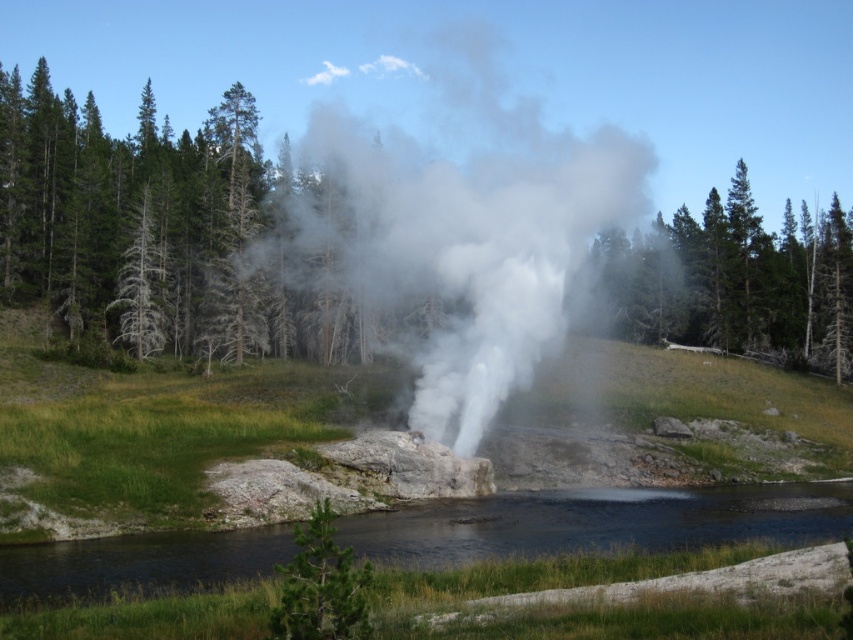
Is point (746, 196) farther from viewer compared to point (283, 627)?

That is True.

Can you confirm if green matte tree at upper right is smaller than green textured tree at center?

No.

Identify the location of green matte tree at upper right. This screenshot has width=853, height=640. (740, 280).

Between white vapor steam at center and green matte tree at upper right, which one is positioned higher?

white vapor steam at center is above.

Which is behind, point (354, 154) or point (630, 275)?

The point (630, 275) is behind.

Which is in front, point (534, 220) or point (675, 316)?

Positioned in front is point (534, 220).

Locate an element on the screen. This screenshot has width=853, height=640. white vapor steam at center is located at coordinates (477, 224).

Is clear water at center closer to the viewer compared to green matte tree at upper right?

That is True.

Can you confirm if clear water at center is positioned below green matte tree at upper right?

Indeed, clear water at center is positioned under green matte tree at upper right.

Is point (795, 515) closer to camera compared to point (693, 298)?

Yes, it is in front of point (693, 298).

Identify the location of clear water at center. Image resolution: width=853 pixels, height=640 pixels. (596, 522).